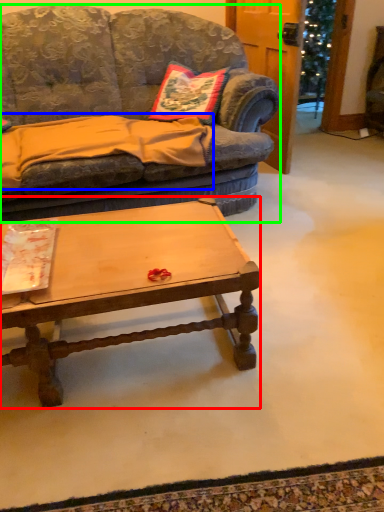
Question: Considering the real-world distances, which object is farthest from coffee table (highlighted by a red box)? blanket (highlighted by a blue box) or studio couch (highlighted by a green box)?

Choices:
 (A) blanket
 (B) studio couch

Answer: (B)